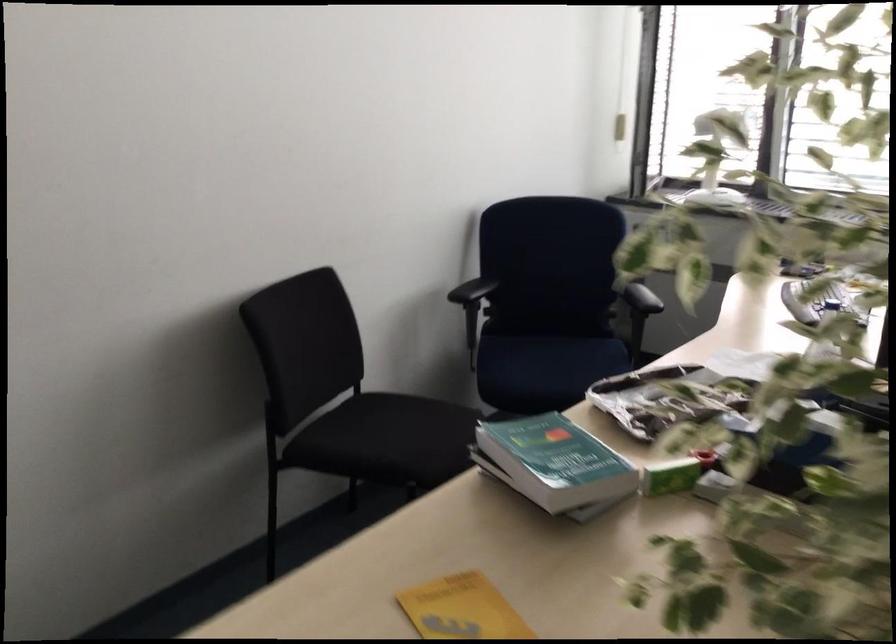
At what (x,y) coordinates should I click in order to perform the action: click on yellow booklet. Please return your answer as a coordinate pair (x, y). The image size is (896, 644). Looking at the image, I should click on (461, 609).